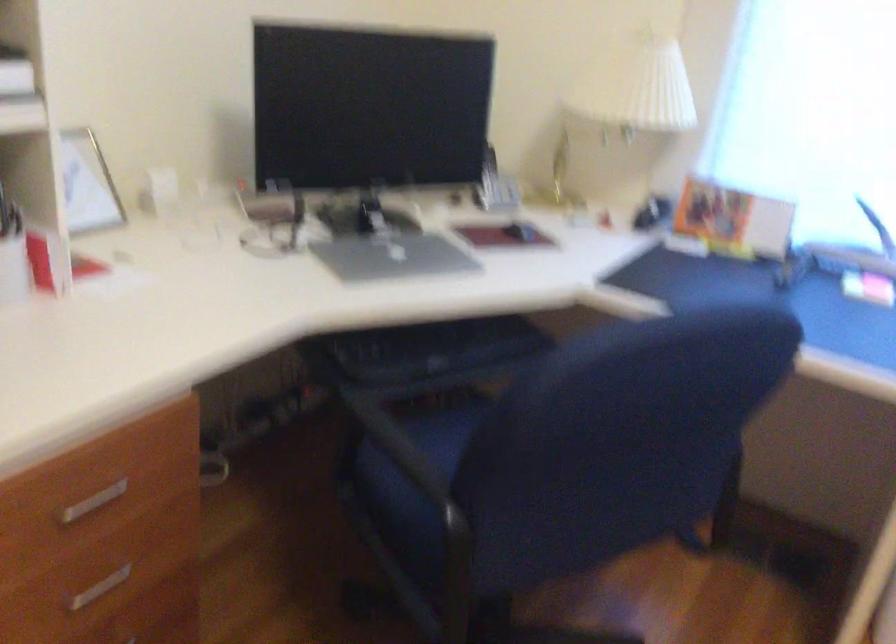
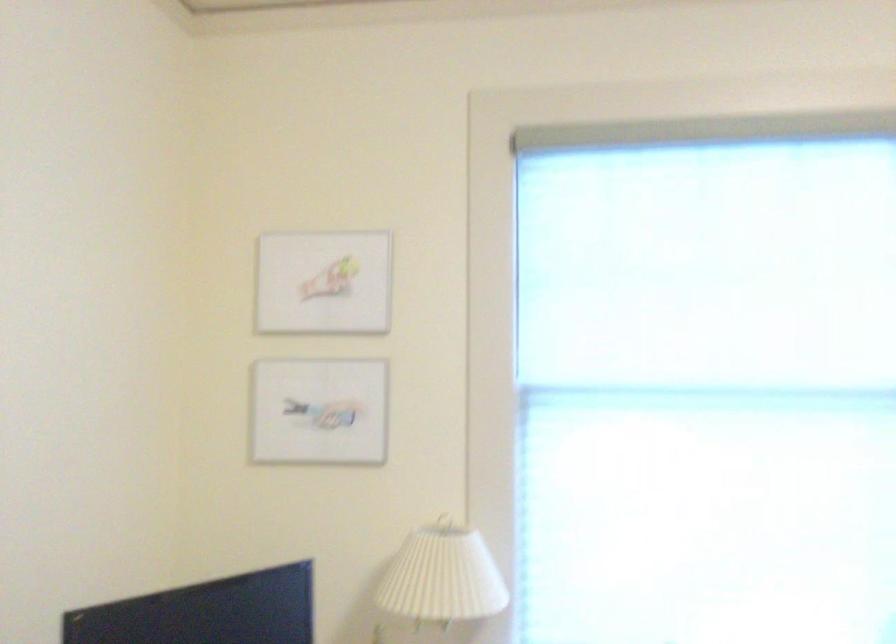
The images are taken continuously from a first-person perspective. In which direction is your viewpoint rotating?

The rotation direction of the camera is right-up.